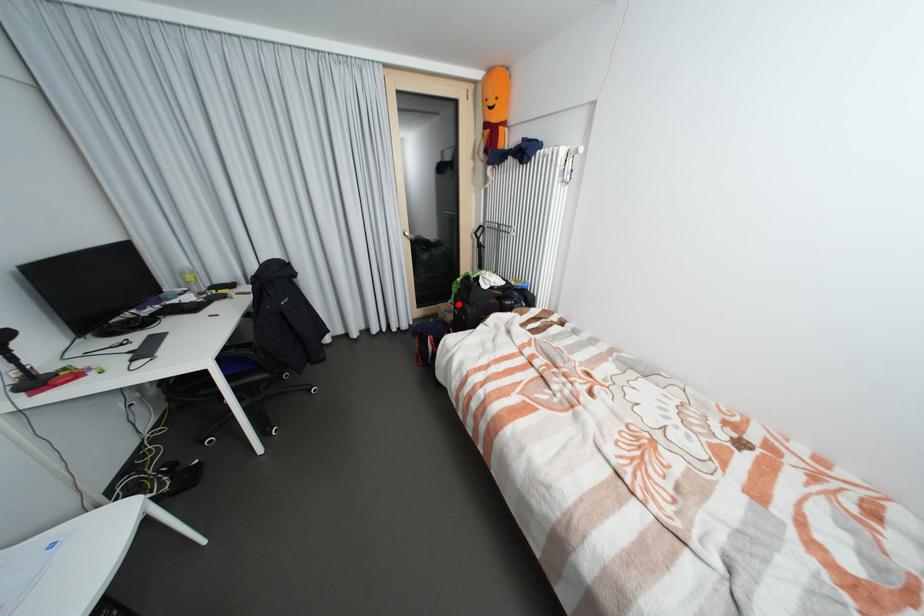
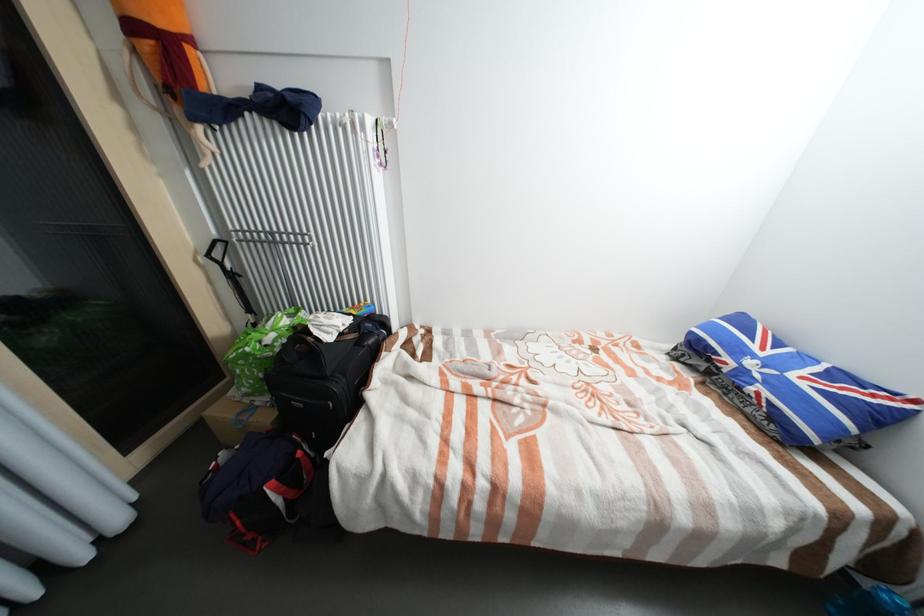
Question: I am providing you with two images of the same scene from different viewpoints. A red point is marked on the first image. Can you still see the location of the red point in image 2?

Choices:
 (A) Yes
 (B) No

Answer: (A)